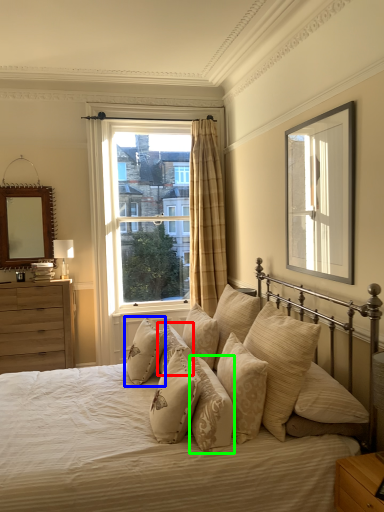
Question: Which object is the farthest from pillow (highlighted by a red box)? Choose among these: pillow (highlighted by a blue box) or pillow (highlighted by a green box).

Choices:
 (A) pillow
 (B) pillow

Answer: (B)